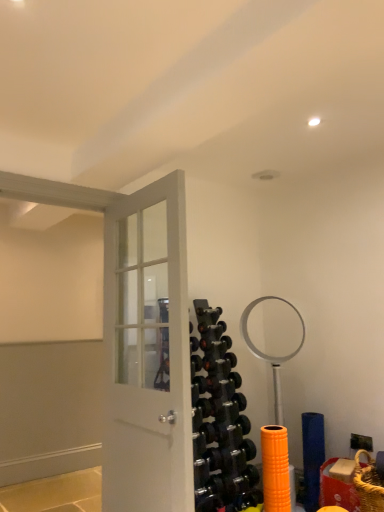
Question: From the image's perspective, is black rubber dumbbell at center, the 2th dumbbell in the top-to-bottom sequence, located above or below black rubber dumbbell at center, acting as the 3th dumbbell starting from the bottom?

Choices:
 (A) below
 (B) above

Answer: (A)

Question: Does point (x=203, y=367) appear closer or farther from the camera than point (x=213, y=346)?

Choices:
 (A) closer
 (B) farther

Answer: (A)

Question: Estimate the real-world distances between objects in this image. Which object is farther from the white glossy door at center?

Choices:
 (A) black rubber dumbbell at center, arranged as the 3th dumbbell when viewed from the top
 (B) black rubber dumbbell at center, which is counted as the first dumbbell, starting from the top
 (C) black rubber dumbbell at center, the 2th dumbbell in the top-to-bottom sequence

Answer: (B)

Question: Which object is the farthest from the white glossy door at center?

Choices:
 (A) black rubber dumbbell at center, acting as the 3th dumbbell starting from the bottom
 (B) black rubber dumbbell at center, which is counted as the first dumbbell, starting from the bottom
 (C) black rubber dumbbell at center, placed as the 2th dumbbell when sorted from bottom to top

Answer: (A)